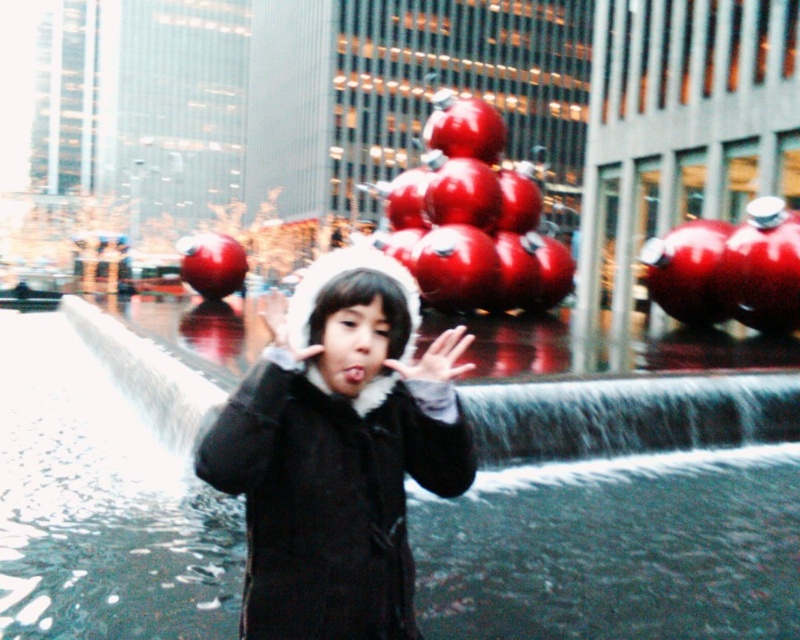
You are a photographer trying to capture the child in the scene. The matte black coat at center and the white fluffy hand at center are both in focus. Which object is closer to the camera?

The matte black coat at center is closer to the viewer than the white fluffy hand at center, so the matte black coat at center would be in focus while the white fluffy hand at center may appear slightly blurred.

You are a fashion designer observing the scene. You notice the matte black coat at center and the white fluffy hand at center. Which object has a greater width in the image?

The matte black coat at center has a greater width than the white fluffy hand at center.

In the holiday scene with the child and the festive decorations, you notice the matte black coat at center and the white fluffy hand at center. Which object is positioned higher up in the image?

The matte black coat at center is taller than the white fluffy hand at center, so the matte black coat at center is positioned higher up in the image.